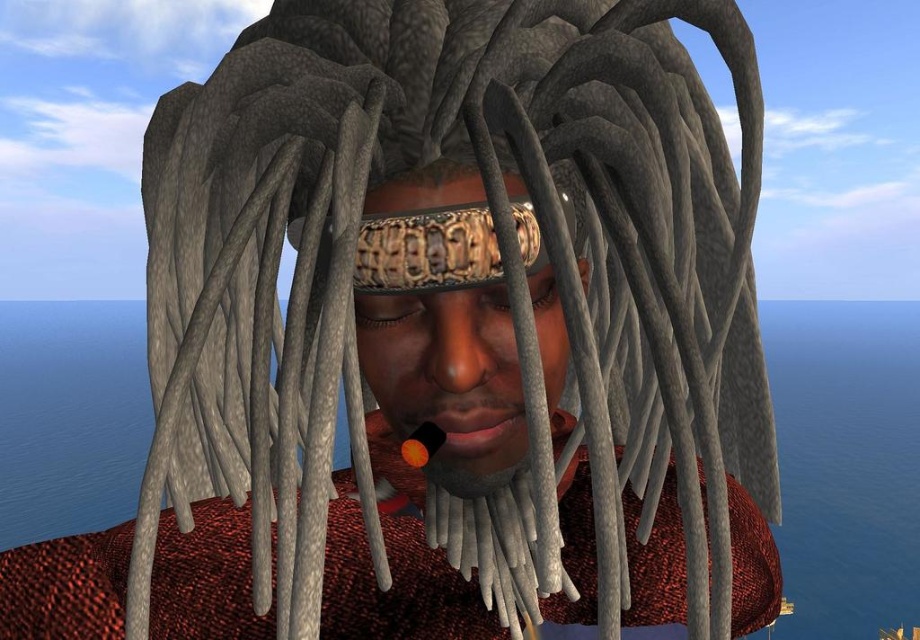
Question: Can you confirm if textured gray dreadlocks at center is bigger than metallic gold headband at center?

Choices:
 (A) no
 (B) yes

Answer: (B)

Question: Considering the relative positions of textured gray dreadlocks at center and metallic gold headband at center in the image provided, where is textured gray dreadlocks at center located with respect to metallic gold headband at center?

Choices:
 (A) below
 (B) above

Answer: (A)

Question: Can you confirm if textured gray dreadlocks at center is thinner than metallic gold headband at center?

Choices:
 (A) no
 (B) yes

Answer: (A)

Question: Which point is farther to the camera?

Choices:
 (A) textured gray dreadlocks at center
 (B) metallic gold headband at center

Answer: (B)